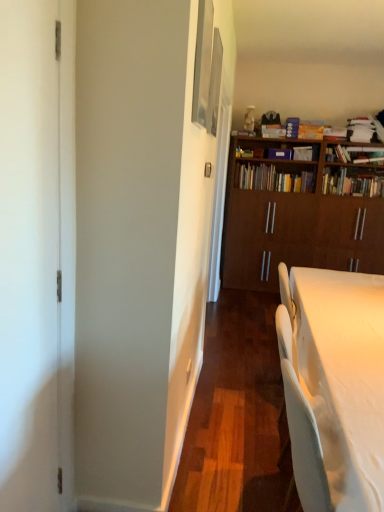
Question: Which is correct: wooden bookshelf at center, the third book in the right-to-left sequence, is inside wooden bookshelf at upper right, the first book positioned from the right, or outside of it?

Choices:
 (A) outside
 (B) inside

Answer: (A)

Question: Considering the positions of point (243, 170) and point (372, 186), is point (243, 170) closer or farther from the camera than point (372, 186)?

Choices:
 (A) farther
 (B) closer

Answer: (A)

Question: Which of these objects is positioned farthest from the brown wood bookcase at upper right?

Choices:
 (A) metallic silver picture frame at upper center, acting as the second picture frame starting from the back
 (B) metallic silver picture frame at upper center, which is the 2th picture frame in front-to-back order
 (C) white glossy door at left
 (D) white glossy desk at lower right
 (E) wooden bookshelf at center, the third book in the right-to-left sequence

Answer: (C)

Question: Which object is the farthest from the brown wood bookcase at upper right?

Choices:
 (A) white glossy door at left
 (B) metallic silver picture frame at upper center, acting as the second picture frame starting from the back
 (C) wooden bookshelf at upper right, positioned as the 3th book in left-to-right order
 (D) wooden bookshelf at center, the first book positioned from the left
 (E) metallic silver picture frame at upper center, which is the 2th picture frame in front-to-back order

Answer: (A)